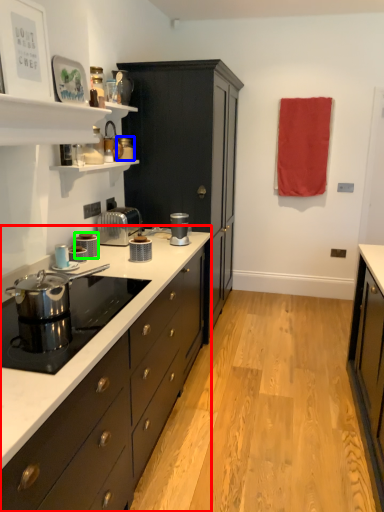
Question: Which object is positioned farthest from countertop (highlighted by a red box)? Select from appliance (highlighted by a blue box) and kitchen appliance (highlighted by a green box).

Choices:
 (A) appliance
 (B) kitchen appliance

Answer: (A)